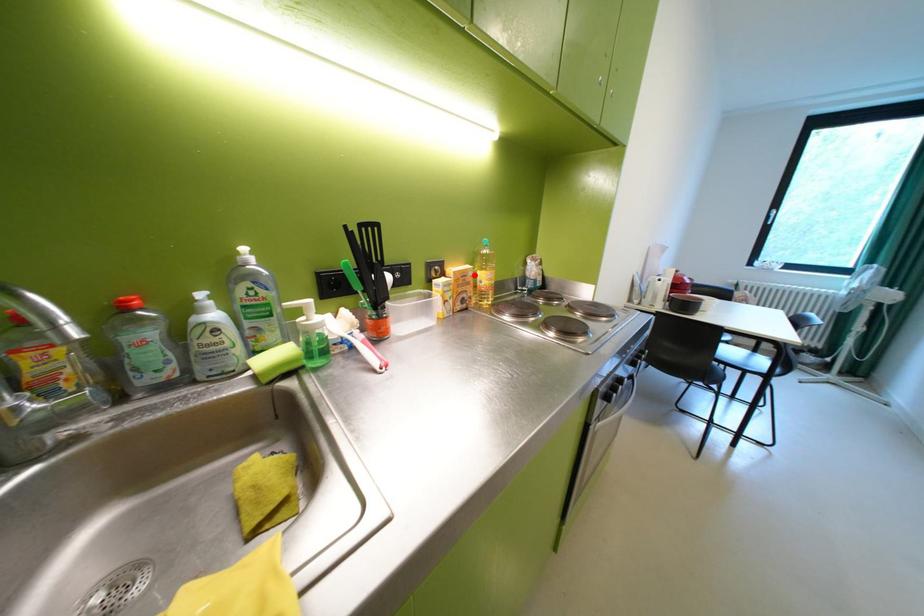
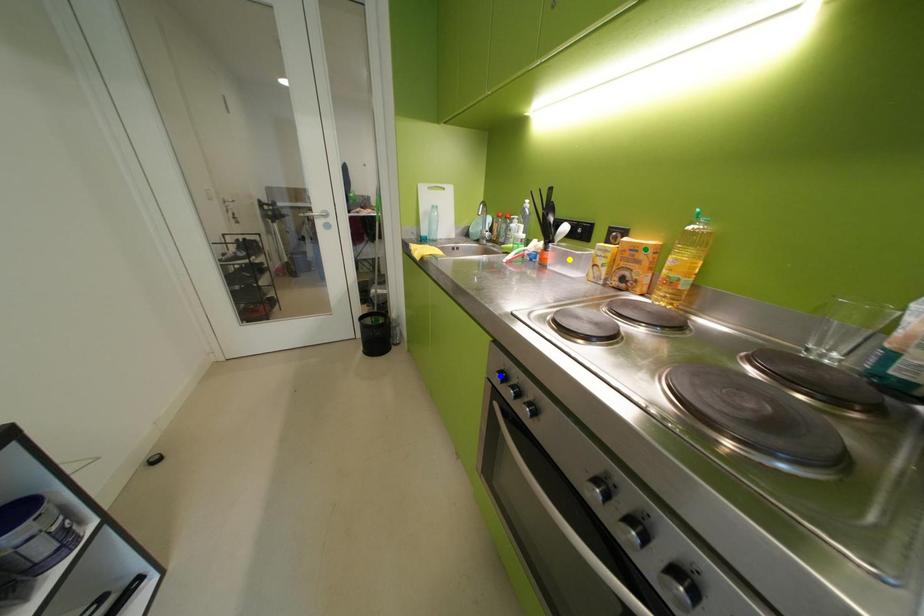
Question: I am providing you with two images of the same scene from different viewpoints. A red point is marked on the first image. You are given multiple points on the second image. Which point in image 2 represents the same 3d spot as the red point in image 1?

Choices:
 (A) green point
 (B) blue point
 (C) yellow point

Answer: (A)